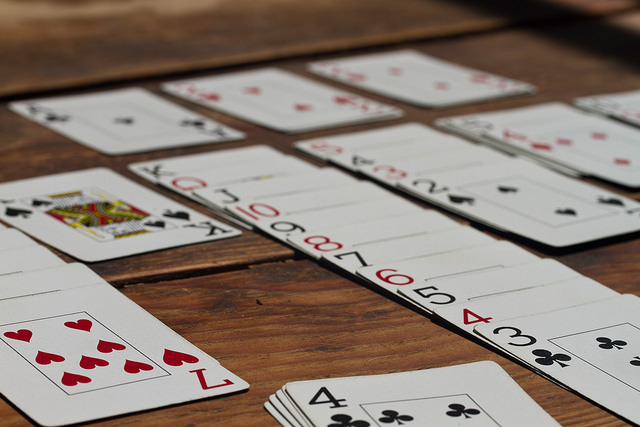
Find the location of `table`. table is located at coordinates (224, 329).